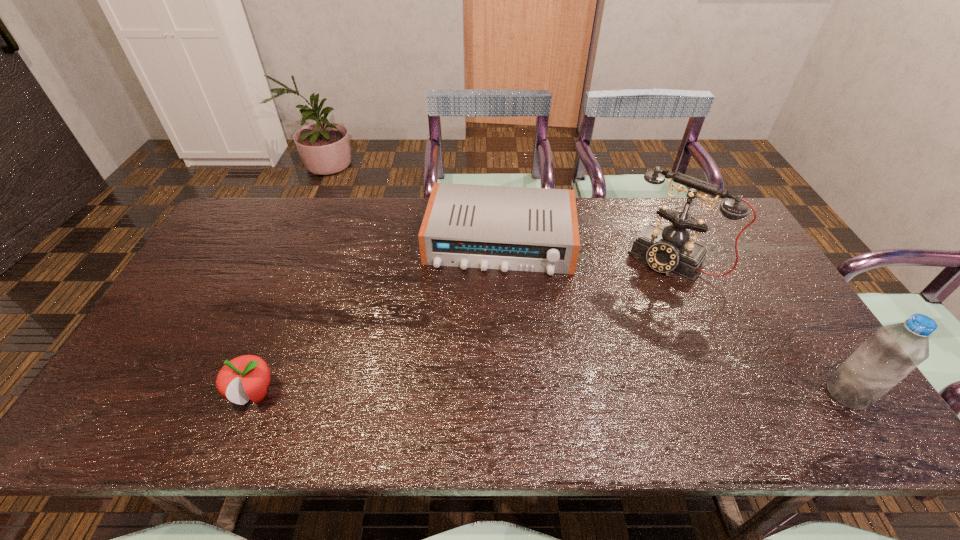
Image resolution: width=960 pixels, height=540 pixels. I want to click on free spot on the desktop that is between the leftmost object and the water bottle and is positioned on the dial of the third object from left to right, so click(x=570, y=394).

I want to click on free space on the desktop that is between the apple and the water bottle and is positioned on the control panel of the third object from right to left, so click(x=486, y=394).